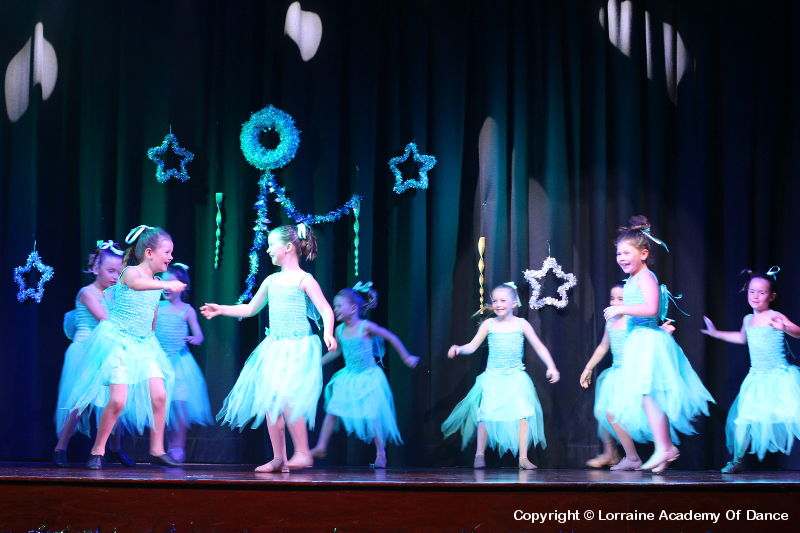
Where is `blue circle wreath decorations`? blue circle wreath decorations is located at coordinates (272, 151).